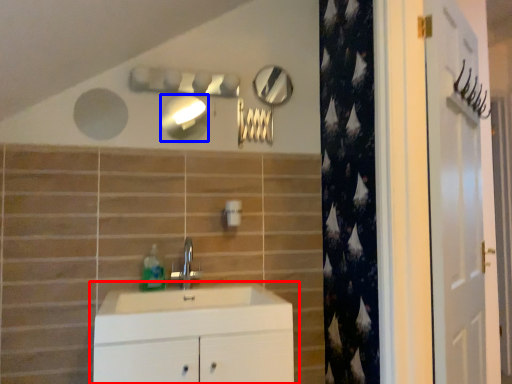
Question: Which object appears closest to the camera in this image, bathroom cabinet (highlighted by a red box) or mirror (highlighted by a blue box)?

Choices:
 (A) bathroom cabinet
 (B) mirror

Answer: (A)